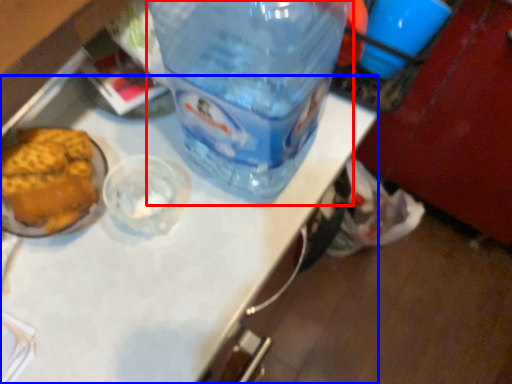
Question: Among these objects, which one is farthest to the camera, bottle (highlighted by a red box) or table top (highlighted by a blue box)?

Choices:
 (A) bottle
 (B) table top

Answer: (A)